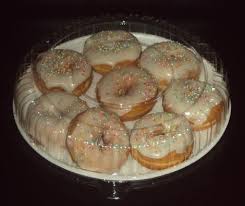
Locate an element on the screen. plastic cover for the plate is located at coordinates (156, 107).